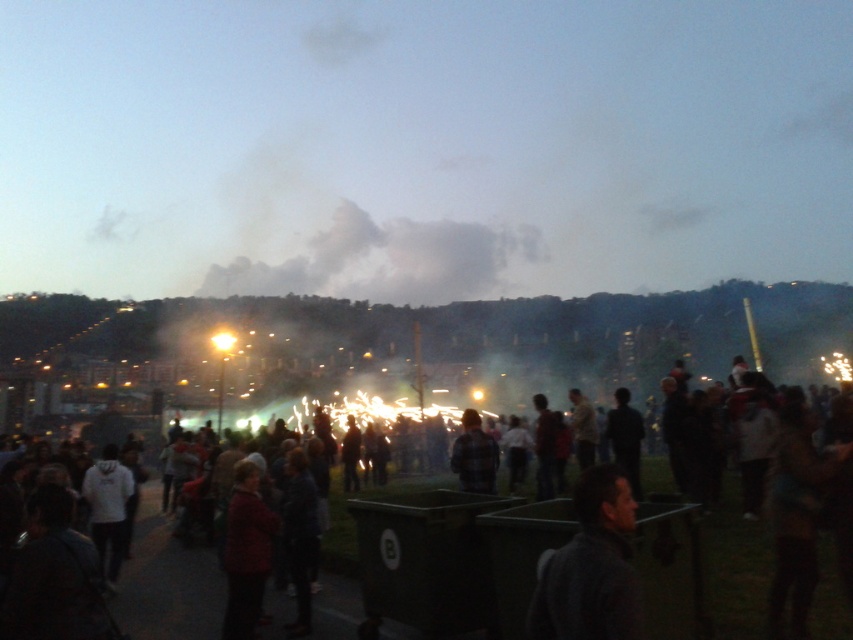
Does dark clothing crowd at center come in front of plaid fabric shirt at center?

That is True.

Between point (653, 532) and point (469, 456), which one is positioned in front?

Point (653, 532) is more forward.

Identify the location of dark clothing crowd at center. Image resolution: width=853 pixels, height=640 pixels. (167, 580).

Find the location of a particular element. The height and width of the screenshot is (640, 853). dark clothing crowd at center is located at coordinates (167, 580).

Does dark clothing crowd at center appear under dark gray fabric at center?

Yes, dark clothing crowd at center is below dark gray fabric at center.

Image resolution: width=853 pixels, height=640 pixels. What do you see at coordinates (167, 580) in the screenshot?
I see `dark clothing crowd at center` at bounding box center [167, 580].

I want to click on dark clothing crowd at center, so click(x=167, y=580).

Is dark gray fabric at center below plaid fabric shirt at center?

Actually, dark gray fabric at center is above plaid fabric shirt at center.

Does dark gray fabric at center have a lesser width compared to plaid fabric shirt at center?

Indeed, dark gray fabric at center has a lesser width compared to plaid fabric shirt at center.

Locate an element on the screen. This screenshot has width=853, height=640. dark gray fabric at center is located at coordinates (590, 568).

The width and height of the screenshot is (853, 640). I want to click on dark gray fabric at center, so click(590, 568).